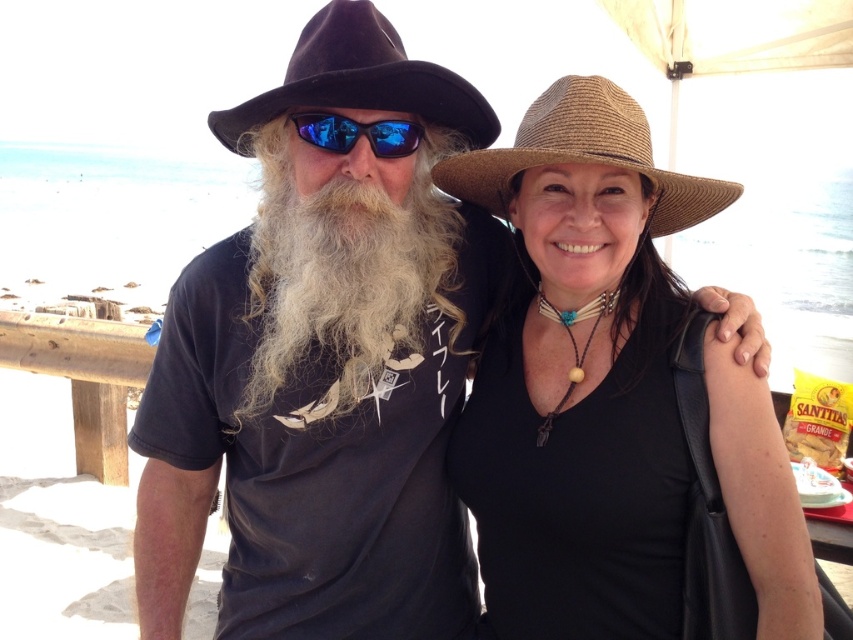
Does brown straw hat at upper center have a smaller size compared to braided straw hat at upper right?

Actually, brown straw hat at upper center might be larger than braided straw hat at upper right.

Is point (556, 298) positioned before point (543, 115)?

No.

Is point (633, 509) positioned after point (694, 216)?

No, (633, 509) is closer to viewer.

Identify the location of brown straw hat at upper center. The image size is (853, 640). (579, 376).

Which is below, brown straw hat at upper center or white curly beard at center?

Positioned lower is brown straw hat at upper center.

Between brown straw hat at upper center and white curly beard at center, which one appears on the right side from the viewer's perspective?

brown straw hat at upper center is more to the right.

Does point (657, 317) lie behind point (340, 241)?

Yes.

Image resolution: width=853 pixels, height=640 pixels. Identify the location of brown straw hat at upper center. (579, 376).

Who is higher up, brown straw hat at upper center or blue reflective lenses at center?

blue reflective lenses at center is above.

Who is more forward, [624,298] or [374,138]?

Point [374,138] is more forward.

Which is in front, point (531, 154) or point (354, 145)?

Point (531, 154)

Locate an element on the screen. brown straw hat at upper center is located at coordinates (579, 376).